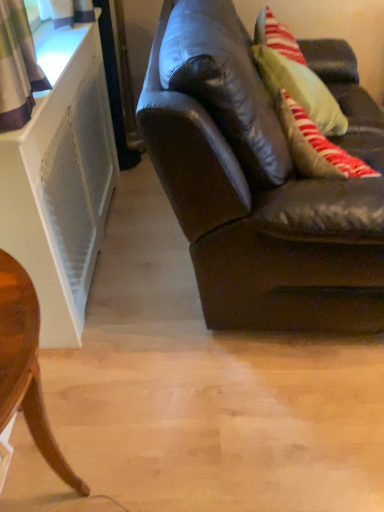
The height and width of the screenshot is (512, 384). I want to click on brown leather couch at right, so click(x=271, y=215).

This screenshot has width=384, height=512. What do you see at coordinates (271, 215) in the screenshot?
I see `brown leather couch at right` at bounding box center [271, 215].

Identify the location of wooden round table at lower left. This screenshot has width=384, height=512. (26, 366).

What do you see at coordinates (26, 366) in the screenshot?
I see `wooden round table at lower left` at bounding box center [26, 366].

The height and width of the screenshot is (512, 384). Find the location of `brown leather couch at right`. brown leather couch at right is located at coordinates (271, 215).

Is brown leather couch at right to the left of wooden round table at lower left from the viewer's perspective?

In fact, brown leather couch at right is to the right of wooden round table at lower left.

Is brown leather couch at right further to the viewer compared to wooden round table at lower left?

Yes, it is behind wooden round table at lower left.

Is point (244, 222) positioned after point (42, 418)?

Yes, it is.

From the image's perspective, does brown leather couch at right appear lower than wooden round table at lower left?

Actually, brown leather couch at right appears above wooden round table at lower left in the image.

From a real-world perspective, is brown leather couch at right under wooden round table at lower left?

No, from a real-world perspective, brown leather couch at right is not beneath wooden round table at lower left.

Considering the sizes of objects brown leather couch at right and wooden round table at lower left in the image provided, who is wider, brown leather couch at right or wooden round table at lower left?

Wider between the two is brown leather couch at right.

Who is taller, brown leather couch at right or wooden round table at lower left?

brown leather couch at right is taller.

Considering the relative sizes of brown leather couch at right and wooden round table at lower left in the image provided, is brown leather couch at right smaller than wooden round table at lower left?

Incorrect, brown leather couch at right is not smaller in size than wooden round table at lower left.

Is brown leather couch at right located outside wooden round table at lower left?

Yes, brown leather couch at right is located beyond the bounds of wooden round table at lower left.

Is brown leather couch at right placed right next to wooden round table at lower left?

No, brown leather couch at right is not beside wooden round table at lower left.

Looking at this image, is brown leather couch at right positioned with its back to wooden round table at lower left?

That's not correct — brown leather couch at right is not looking away from wooden round table at lower left.

How different are the orientations of brown leather couch at right and wooden round table at lower left in degrees?

They differ by 2.11 degrees in their facing directions.

How much distance is there between brown leather couch at right and wooden round table at lower left?

33.19 inches.

Locate an element on the screen. This screenshot has width=384, height=512. chair below the brown leather couch at right (from the image's perspective) is located at coordinates (26, 366).

In the scene shown: Is wooden round table at lower left to the left of brown leather couch at right from the viewer's perspective?

Correct, you'll find wooden round table at lower left to the left of brown leather couch at right.

Is wooden round table at lower left further to the viewer compared to brown leather couch at right?

No, it is in front of brown leather couch at right.

Is point (37, 389) positioned before point (370, 258)?

Yes, point (37, 389) is in front of point (370, 258).

From the image's perspective, between wooden round table at lower left and brown leather couch at right, which one is located above?

brown leather couch at right, from the image's perspective.

From a real-world perspective, which object rests below the other?

In real-world perspective, wooden round table at lower left is lower.

Considering the sizes of objects wooden round table at lower left and brown leather couch at right in the image provided, who is thinner, wooden round table at lower left or brown leather couch at right?

wooden round table at lower left.

Who is taller, wooden round table at lower left or brown leather couch at right?

Standing taller between the two is brown leather couch at right.

Which of these two, wooden round table at lower left or brown leather couch at right, is bigger?

With larger size is brown leather couch at right.

Is wooden round table at lower left spatially inside brown leather couch at right, or outside of it?

wooden round table at lower left lies outside brown leather couch at right.

Does wooden round table at lower left touch brown leather couch at right?

No, wooden round table at lower left is not in contact with brown leather couch at right.

Is wooden round table at lower left positioned with its back to brown leather couch at right?

No, wooden round table at lower left is not facing away from brown leather couch at right.

In order to click on studio couch that is above the wooden round table at lower left (from a real-world perspective) in this screenshot , I will do `click(271, 215)`.

At what (x,y) coordinates should I click in order to perform the action: click on chair located on the left of brown leather couch at right. Please return your answer as a coordinate pair (x, y). This screenshot has width=384, height=512. Looking at the image, I should click on (26, 366).

Locate an element on the screen. This screenshot has height=512, width=384. studio couch located above the wooden round table at lower left (from the image's perspective) is located at coordinates (271, 215).